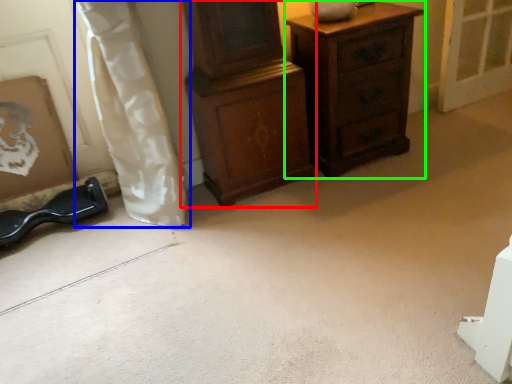
Question: Considering the real-world distances, which object is farthest from chest of drawers (highlighted by a red box)? curtain (highlighted by a blue box) or chest of drawers (highlighted by a green box)?

Choices:
 (A) curtain
 (B) chest of drawers

Answer: (A)